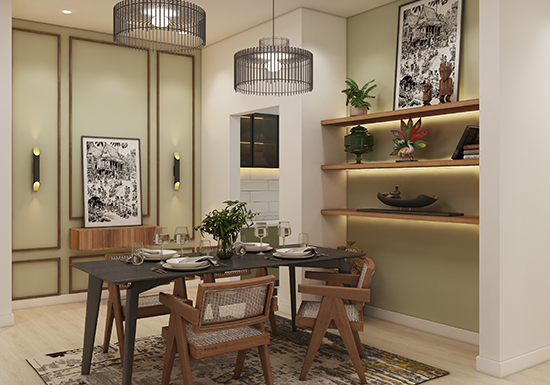
This screenshot has width=550, height=385. Find the location of `rug`. rug is located at coordinates (148, 369).